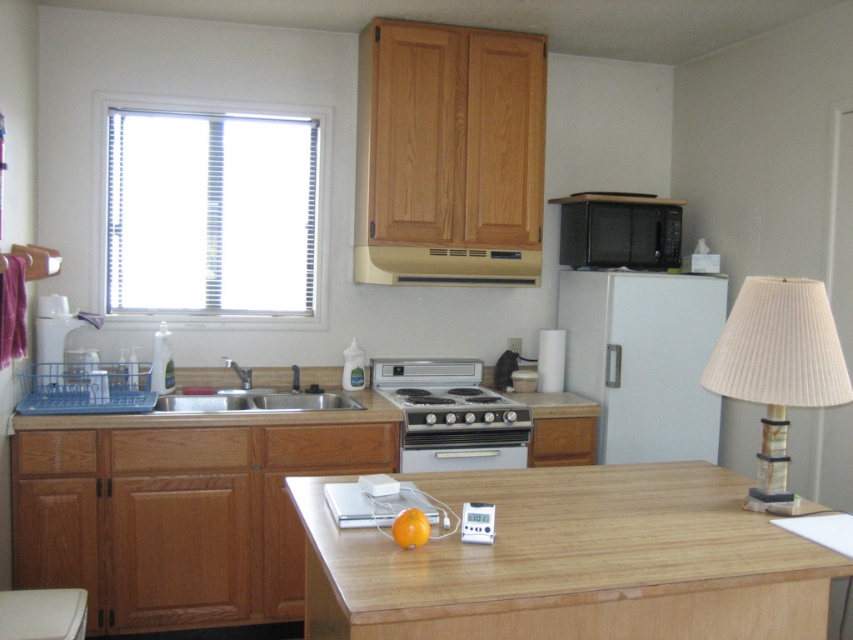
Question: Which object appears closest to the camera in this image?

Choices:
 (A) beige matte exhaust hood at upper center
 (B) silver metallic sink at lower center
 (C) satin silver oven at center

Answer: (B)

Question: Does wooden at center come in front of white plastic dishwasher at lower left?

Choices:
 (A) no
 (B) yes

Answer: (B)

Question: Among these points, which one is farthest from the camera?

Choices:
 (A) (527, 273)
 (B) (403, 445)

Answer: (A)

Question: Which point is closer to the camera taking this photo?

Choices:
 (A) (381, 256)
 (B) (347, 408)

Answer: (B)

Question: Does wooden at center appear over silver metallic sink at lower center?

Choices:
 (A) no
 (B) yes

Answer: (A)

Question: Can you confirm if white matte refrigerator at center-right is bigger than satin silver oven at center?

Choices:
 (A) yes
 (B) no

Answer: (A)